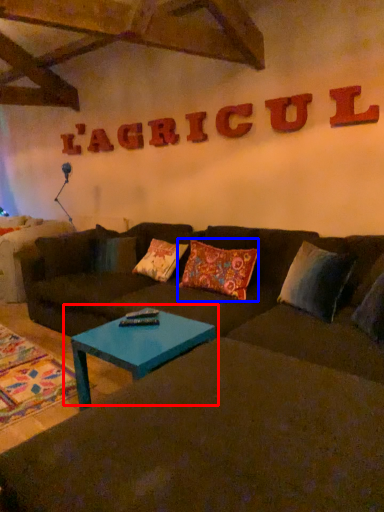
Question: Which of the following is the farthest to the observer, coffee table (highlighted by a red box) or pillow (highlighted by a blue box)?

Choices:
 (A) coffee table
 (B) pillow

Answer: (B)